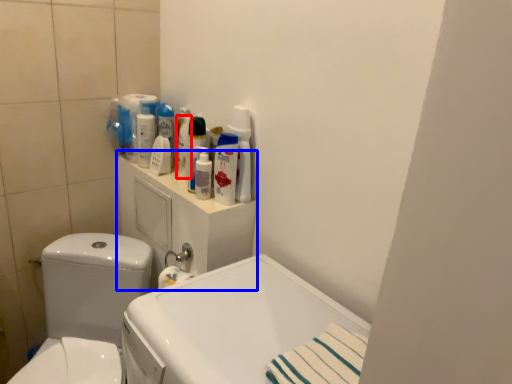
Question: Which point is further to the camera, cleaning product (highlighted by a red box) or medicine cabinet (highlighted by a blue box)?

Choices:
 (A) cleaning product
 (B) medicine cabinet

Answer: (A)